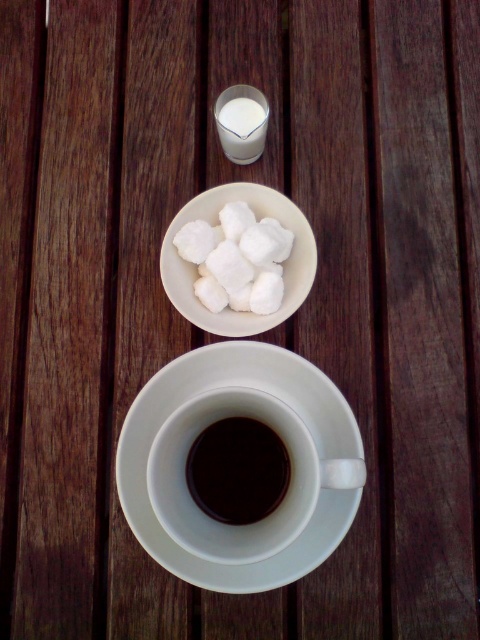
Which of these two, white ceramic saucer at center or white sugar cubes at center, stands shorter?

Standing shorter between the two is white sugar cubes at center.

Between white ceramic saucer at center and white sugar cubes at center, which one appears on the right side from the viewer's perspective?

Positioned to the right is white ceramic saucer at center.

Which is in front, point (260, 412) or point (244, 276)?

Positioned in front is point (260, 412).

Image resolution: width=480 pixels, height=640 pixels. I want to click on white ceramic saucer at center, so click(x=272, y=428).

Which is more to the right, white sugar cubes at center or black matte cup at center?

black matte cup at center

Is point (196, 291) positioned in front of point (256, 504)?

No, it is not.

The height and width of the screenshot is (640, 480). Identify the location of white sugar cubes at center. click(237, 259).

How far apart are white ceramic saucer at center and black matte cup at center?

white ceramic saucer at center is 1.65 inches away from black matte cup at center.

Who is positioned more to the right, white ceramic saucer at center or black matte cup at center?

From the viewer's perspective, white ceramic saucer at center appears more on the right side.

This screenshot has height=640, width=480. In order to click on white ceramic saucer at center in this screenshot , I will do `click(272, 428)`.

I want to click on white ceramic saucer at center, so click(272, 428).